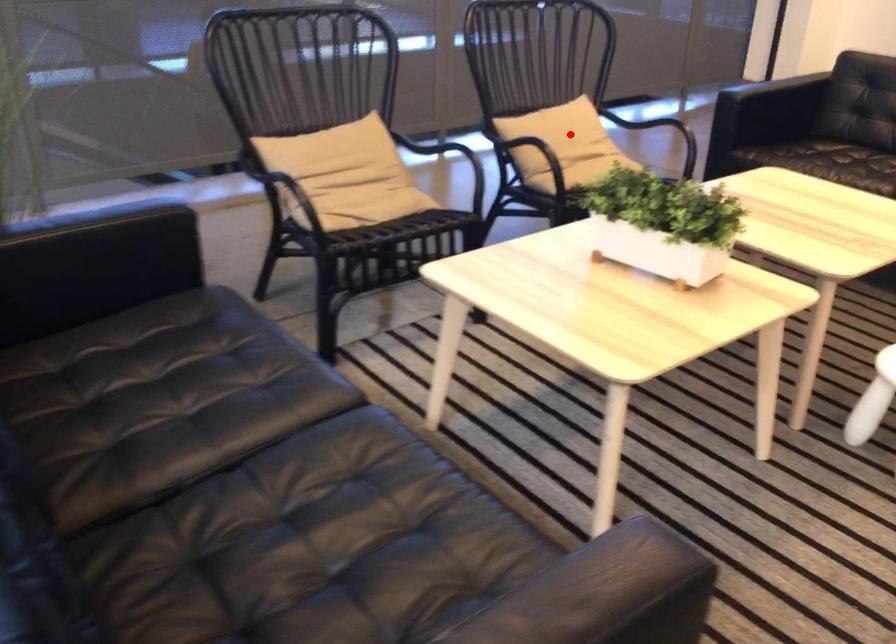
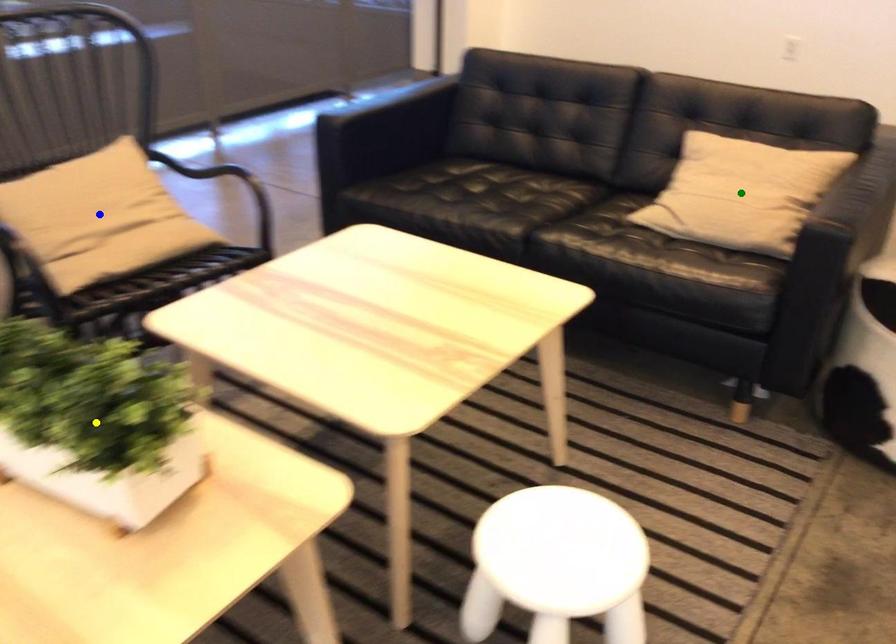
Question: I am providing you with two images of the same scene from different viewpoints. A red point is marked on the first image. You are given multiple points on the second image. Which mark in image 2 goes with the point in image 1?

Choices:
 (A) green point
 (B) blue point
 (C) yellow point

Answer: (B)